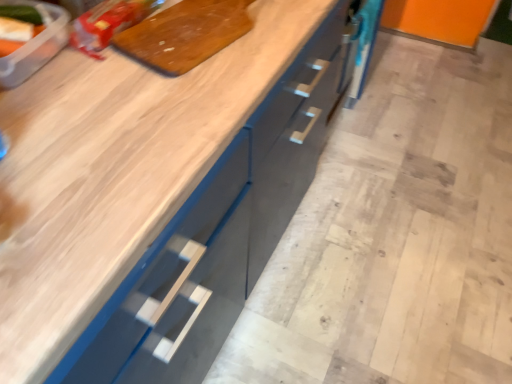
Question: Is translucent plastic container at upper left, placed as the second food when sorted from right to left, wider or thinner than matte plastic bag at upper left, the first food viewed from the back?

Choices:
 (A) wide
 (B) thin

Answer: (B)

Question: Considering their positions, is translucent plastic container at upper left, which is the 2th food from back to front, located in front of or behind matte plastic bag at upper left, the first food viewed from the back?

Choices:
 (A) behind
 (B) front

Answer: (B)

Question: Which is nearer to the wooden cutting board at upper center?

Choices:
 (A) translucent plastic container at upper left, which is counted as the first food, starting from the front
 (B) matte plastic bag at upper left, the second food from the left

Answer: (B)

Question: Which is farther from the matte plastic bag at upper left, which is the second food from front to back?

Choices:
 (A) wooden cutting board at upper center
 (B) translucent plastic container at upper left, arranged as the 1th food when viewed from the left

Answer: (B)